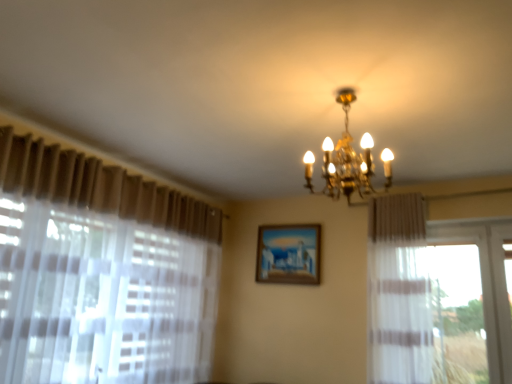
Question: In terms of height, does wooden painted picture frame at center look taller or shorter compared to gold metallic chandelier at upper center?

Choices:
 (A) short
 (B) tall

Answer: (A)

Question: From a real-world perspective, relative to gold metallic chandelier at upper center, is wooden painted picture frame at center vertically above or below?

Choices:
 (A) below
 (B) above

Answer: (A)

Question: From the image's perspective, relative to gold metallic chandelier at upper center, is wooden painted picture frame at center above or below?

Choices:
 (A) below
 (B) above

Answer: (A)

Question: Considering the positions of gold metallic chandelier at upper center and wooden painted picture frame at center in the image, is gold metallic chandelier at upper center wider or thinner than wooden painted picture frame at center?

Choices:
 (A) wide
 (B) thin

Answer: (A)

Question: In the image, is gold metallic chandelier at upper center on the left side or the right side of wooden painted picture frame at center?

Choices:
 (A) left
 (B) right

Answer: (B)

Question: Is gold metallic chandelier at upper center inside or outside of wooden painted picture frame at center?

Choices:
 (A) inside
 (B) outside

Answer: (B)

Question: From a real-world perspective, is gold metallic chandelier at upper center physically located above or below wooden painted picture frame at center?

Choices:
 (A) above
 (B) below

Answer: (A)